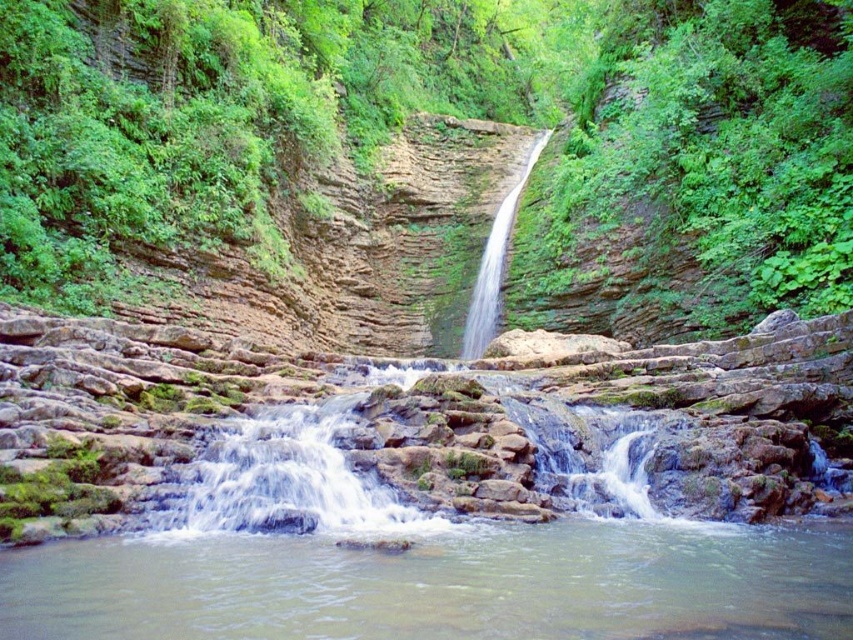
Question: Can you confirm if clear water stream at center is wider than white frothy water at center?

Choices:
 (A) yes
 (B) no

Answer: (A)

Question: Observing the image, what is the correct spatial positioning of clear water stream at center in reference to white frothy water at center?

Choices:
 (A) left
 (B) right

Answer: (B)

Question: Is green leafy vegetation at center below clear water stream at center?

Choices:
 (A) no
 (B) yes

Answer: (A)

Question: Estimate the real-world distances between objects in this image. Which object is farther from the clear water stream at center?

Choices:
 (A) green leafy vegetation at center
 (B) white frothy water at center

Answer: (A)

Question: Which point is closer to the camera?

Choices:
 (A) (405, 580)
 (B) (10, 180)

Answer: (A)

Question: Which point is closer to the camera?

Choices:
 (A) [x=511, y=83]
 (B) [x=332, y=412]

Answer: (B)